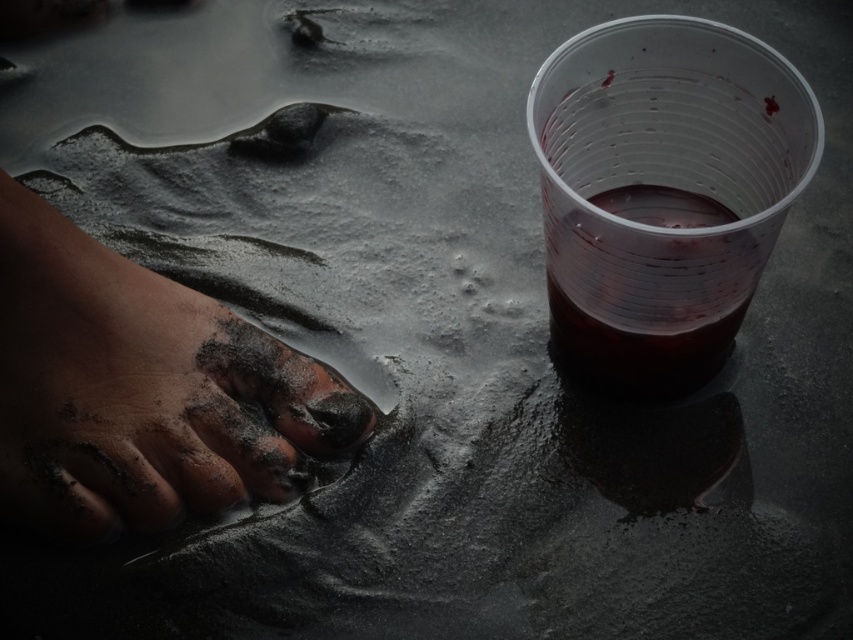
You are at a beach bar and see both the transparent plastic cup at upper right and the translucent plastic cup at upper right. Which cup is closer to you?

The transparent plastic cup at upper right is closer to you because it is in front of the translucent plastic cup at upper right.

You are a photographer trying to capture the dusty skin foot at lower left and the translucent plastic cup at upper right in a single shot. Based on their positions, which object should you adjust your camera to focus on first to ensure both are in frame?

The dusty skin foot at lower left is to the left of the translucent plastic cup at upper right, so you should adjust your camera to focus on the dusty skin foot at lower left first to ensure both are in frame.

Looking at this image, you are standing in the scene and want to move from the point at coordinates point [756,202] to the point at coordinates point [281,388]. Which direction should you face to walk towards the second point?

You should face towards the upper right direction because point [281,388] is located in the upper right relative to point [756,202].